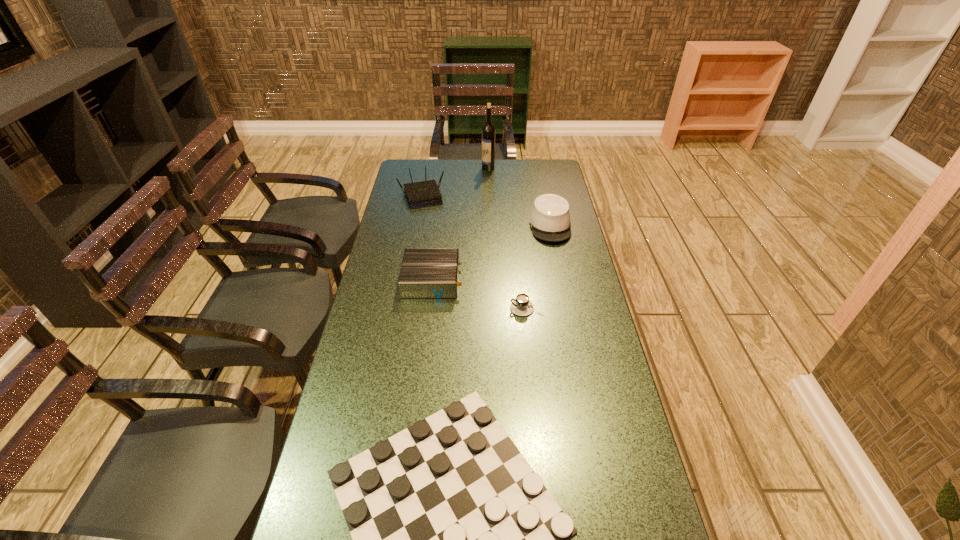
Where is `free space located 0.370m on the label of the tallest object`? The image size is (960, 540). free space located 0.370m on the label of the tallest object is located at coordinates (405, 168).

Find the location of a particular element. The width and height of the screenshot is (960, 540). free spot located on the right of the taller router is located at coordinates (528, 196).

Where is `free space located on the front-facing side of the hat`? free space located on the front-facing side of the hat is located at coordinates (563, 287).

This screenshot has height=540, width=960. Find the location of `free spot located on the back panel of the fourth tallest object`. free spot located on the back panel of the fourth tallest object is located at coordinates (569, 280).

The image size is (960, 540). Find the location of `free region located with the handle on the side of the fifth tallest object`. free region located with the handle on the side of the fifth tallest object is located at coordinates (454, 308).

Identify the location of free region located 0.360m with the handle on the side of the fifth tallest object. (398, 308).

Find the location of a particular element. This screenshot has width=960, height=540. vacant space situated 0.190m with the handle on the side of the fifth tallest object is located at coordinates (451, 308).

Where is `wine bottle that is at the far edge`? The width and height of the screenshot is (960, 540). wine bottle that is at the far edge is located at coordinates (488, 131).

Locate an element on the screen. router positioned at the far edge is located at coordinates (422, 194).

At what (x,y) coordinates should I click in order to perform the action: click on object at the right edge. Please return your answer as a coordinate pair (x, y). Looking at the image, I should click on (549, 220).